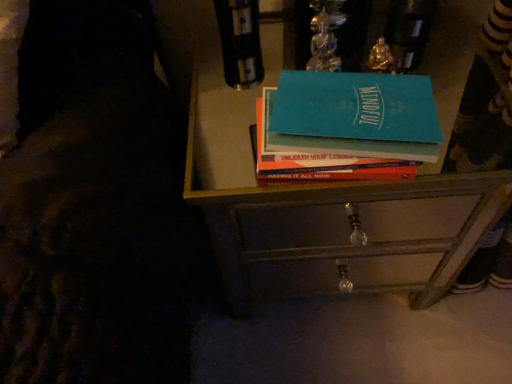
Question: Does point (254, 258) appear closer or farther from the camera than point (435, 264)?

Choices:
 (A) farther
 (B) closer

Answer: (B)

Question: In the image, is metallic drawer at center on the left side or the right side of metallic drawer at center?

Choices:
 (A) left
 (B) right

Answer: (A)

Question: Which is nearer to the metallic drawer at center?

Choices:
 (A) teal matte book at center
 (B) metallic drawer at center

Answer: (B)

Question: Which object is the closest to the teal matte book at center?

Choices:
 (A) metallic drawer at center
 (B) metallic drawer at center

Answer: (B)